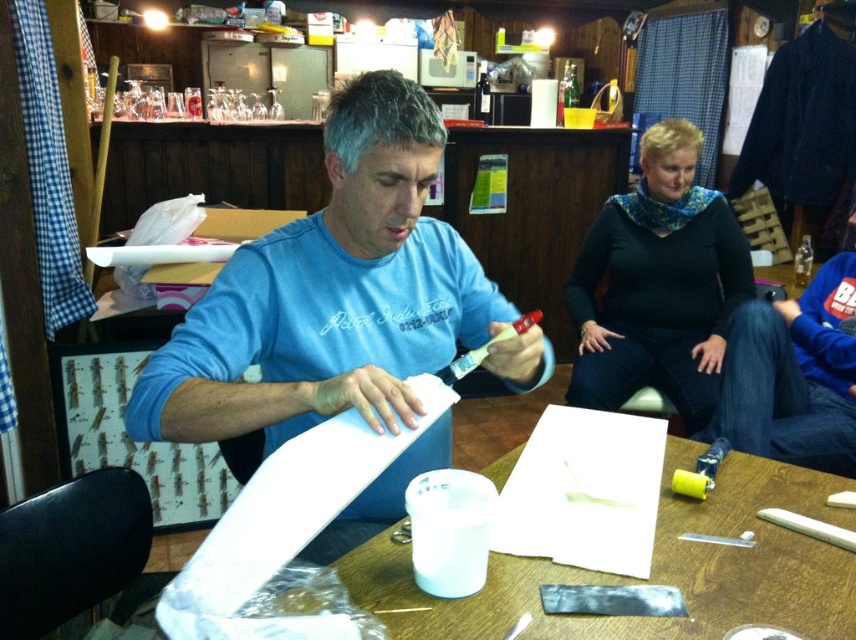
You are a delivery person who needs to place a 1.2 meter long package between the white paperboard at center and the black matte sweater at upper right. Is there enough space to fit the package horizontally between them?

The distance between the white paperboard at center and the black matte sweater at upper right is 1.13 meters. Since the package is 1.2 meters long, it is slightly longer than the available space, so it won generated. 1.13 meters is less than 1.2 meters, so the package won generated. The package cannot be placed horizontally between them due to insufficient space.